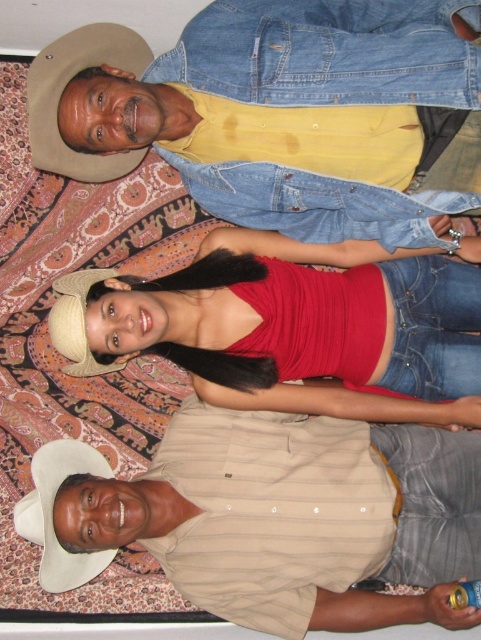
Who is higher up, matte red tank top at center or suede-like tan cowboy hat at upper left?

suede-like tan cowboy hat at upper left is higher up.

Identify the location of matte red tank top at center. (295, 326).

Who is taller, denim jacket at upper center or matte red tank top at center?

denim jacket at upper center is taller.

Does denim jacket at upper center have a lesser width compared to matte red tank top at center?

Correct, denim jacket at upper center's width is less than matte red tank top at center's.

Is point (258, 16) positioned before point (377, 416)?

That is True.

Find the location of a particular element. This screenshot has width=481, height=640. denim jacket at upper center is located at coordinates (282, 113).

Does denim jacket at upper center lie behind tan striped shirt at lower center?

No, denim jacket at upper center is closer to the viewer.

You are a GUI agent. You are given a task and a screenshot of the screen. Output one action in this format:
    pyautogui.click(x=<x>, y=<y>)
    Task: Click on the denim jacket at upper center
    The height and width of the screenshot is (640, 481).
    Given the screenshot: What is the action you would take?
    point(282,113)